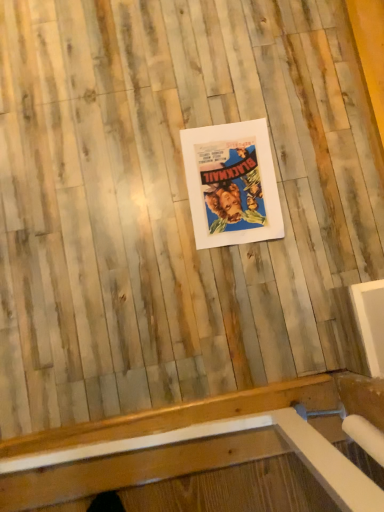
At what (x,y) coordinates should I click in order to perform the action: click on white matte picture frame at center. Please return your answer as a coordinate pair (x, y). Image resolution: width=384 pixels, height=512 pixels. Looking at the image, I should click on (231, 184).

The width and height of the screenshot is (384, 512). Describe the element at coordinates (231, 184) in the screenshot. I see `white matte picture frame at center` at that location.

At what (x,y) coordinates should I click in order to perform the action: click on white matte picture frame at center. Please return your answer as a coordinate pair (x, y). The width and height of the screenshot is (384, 512). Looking at the image, I should click on (231, 184).